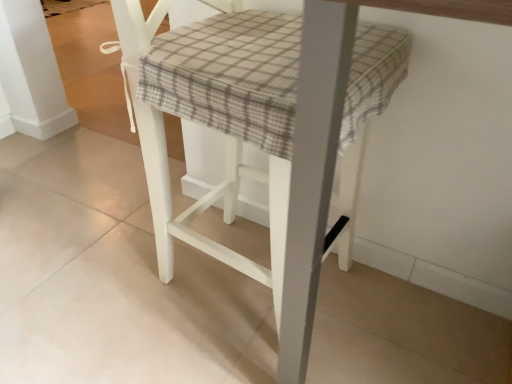
Find the location of a particular element. vacant area to the left of white fabric-covered stool at center is located at coordinates (98, 280).